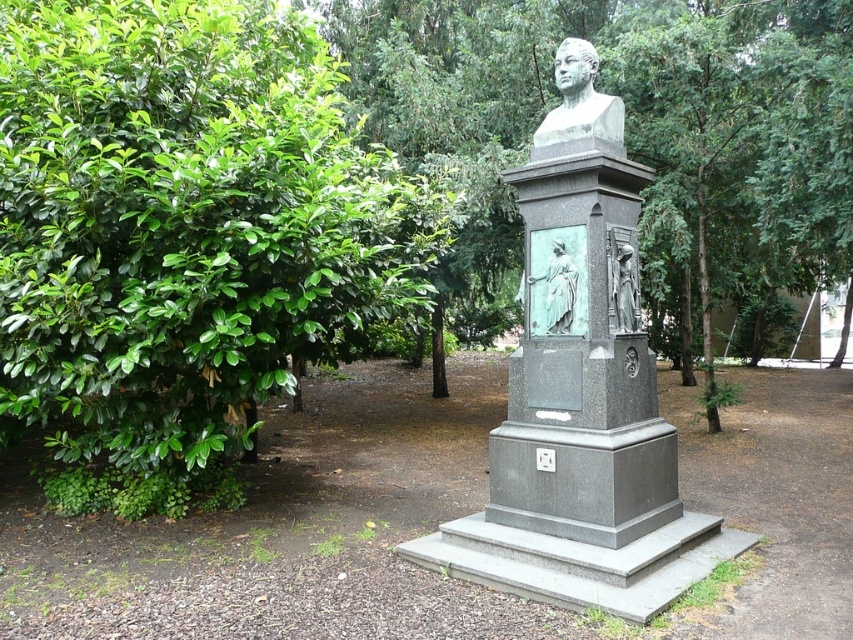
You are standing in the park and see the bronze bust at center and the bronze relief figure at center. Which one is positioned more to the left?

The bronze bust at center is positioned more to the left than the bronze relief figure at center.

You are a gardener who needs to trim the green leafy bush at left and the green patina statue at center. Which object requires trimming because it is taller?

The green leafy bush at left requires trimming because it is taller than the green patina statue at center.

You are an art student visiting the park and want to sketch the bronze bust at center and the bronze relief figure at center. Which one should you use a larger sheet of paper for?

The bronze bust at center is larger in size than the bronze relief figure at center, so you should use a larger sheet of paper for the bronze bust at center.